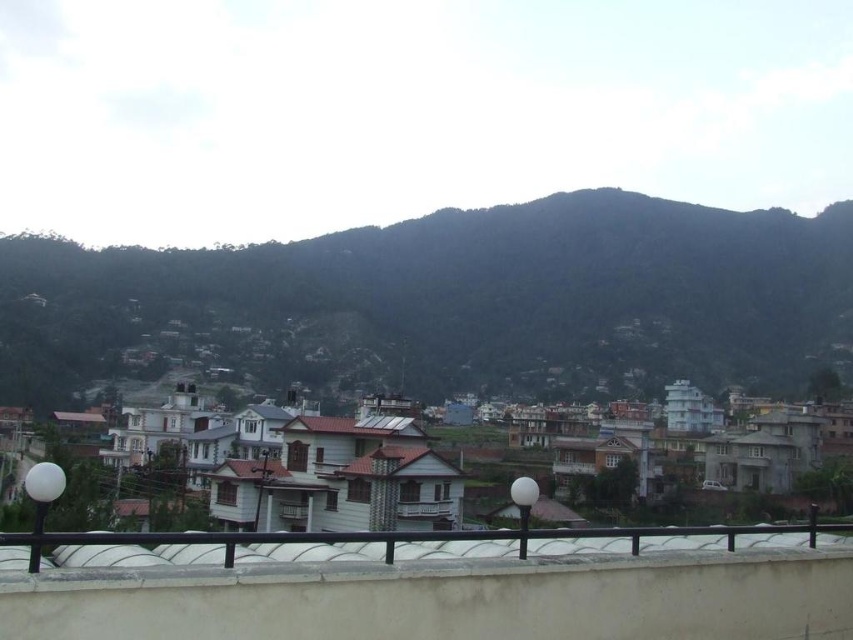
You are a GUI agent. You are given a task and a screenshot of the screen. Output one action in this format:
    pyautogui.click(x=<x>, y=<y>)
    Task: Click on the dark green forested mountain at upper center
    This screenshot has height=640, width=853.
    Given the screenshot: What is the action you would take?
    pyautogui.click(x=450, y=301)

Can you confirm if dark green forested mountain at upper center is smaller than white matte rail at lower center?

No.

Image resolution: width=853 pixels, height=640 pixels. In order to click on dark green forested mountain at upper center in this screenshot , I will do `click(450, 301)`.

Locate an element on the screen. Image resolution: width=853 pixels, height=640 pixels. dark green forested mountain at upper center is located at coordinates (450, 301).

Consider the image. Which of these two, dark green forested mountain at upper center or white painted wooden houses at center, stands taller?

dark green forested mountain at upper center

Between point (680, 264) and point (280, 428), which one is positioned behind?

The point (680, 264) is behind.

The width and height of the screenshot is (853, 640). What are the coordinates of `dark green forested mountain at upper center` in the screenshot? It's located at (450, 301).

Measure the distance between white painted wooden houses at center and camera.

white painted wooden houses at center is 22.24 meters away from camera.

Is point (337, 422) positioned after point (648, 538)?

Yes, point (337, 422) is farther from viewer.

What are the coordinates of `white painted wooden houses at center` in the screenshot? It's located at (339, 480).